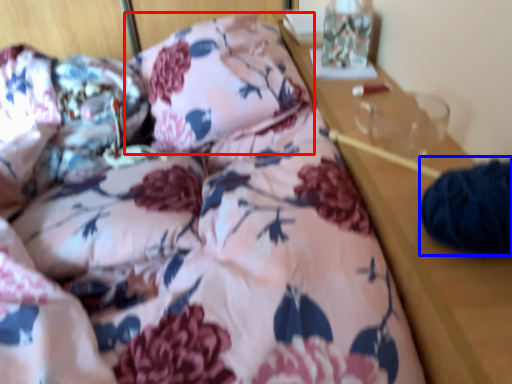
Question: Among these objects, which one is farthest to the camera, pillow (highlighted by a red box) or pillow (highlighted by a blue box)?

Choices:
 (A) pillow
 (B) pillow

Answer: (A)